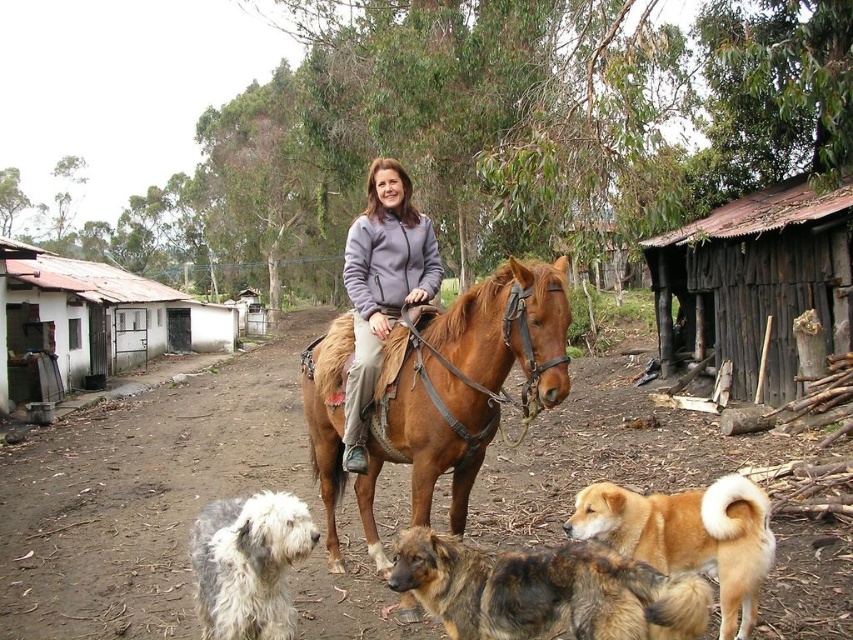
You are a photographer standing at the origin point of the image coordinate system. You want to take a photo focusing on the point at (672,362) and (636,566). Which point is closer to your camera?

Point (672,362) is closer to the camera than point (636,566) because it is further to the camera than the other point.

From the picture: You are a hiker who has just arrived at the scene and wants to follow the path shown in the image. Where should you look to find the brown dirt track at center?

The brown dirt track at center is located at point [143,493] in the image.